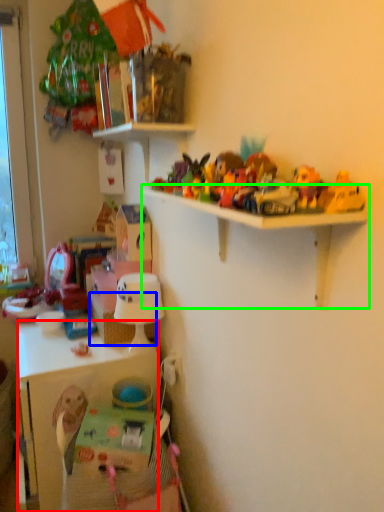
Question: Which is nearer to the cabinetry (highlighted by a red box)? basket (highlighted by a blue box) or shelf (highlighted by a green box).

Choices:
 (A) basket
 (B) shelf

Answer: (A)